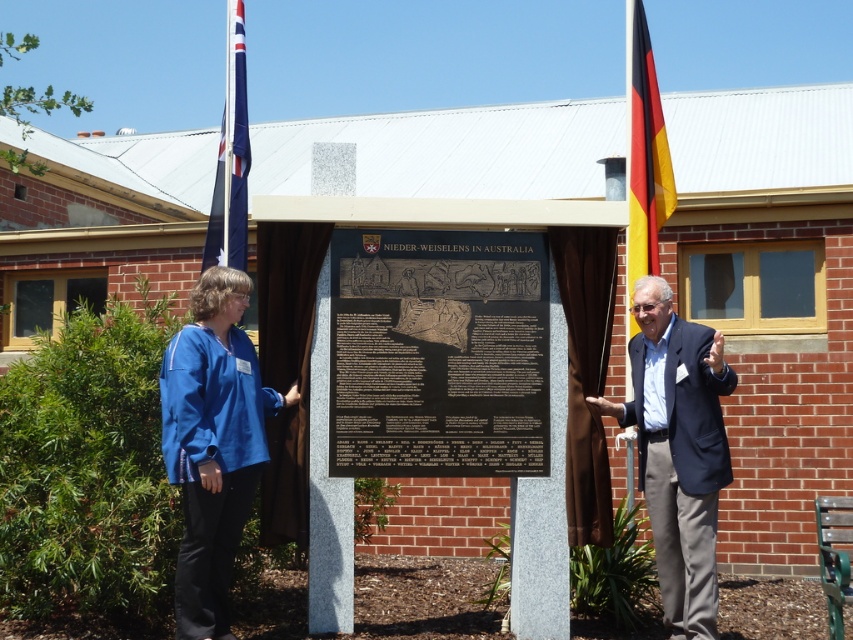
Question: Does dark blue suit at right lie in front of yellow and black striped flag at right?

Choices:
 (A) yes
 (B) no

Answer: (A)

Question: Which point is farther to the camera?

Choices:
 (A) (186, 573)
 (B) (231, 243)
 (C) (712, 451)
 (D) (639, 125)

Answer: (D)

Question: Is blue fabric shirt at left above blue fabric flag at upper left?

Choices:
 (A) yes
 (B) no

Answer: (B)

Question: Which object appears farthest from the camera in this image?

Choices:
 (A) yellow and black striped flag at right
 (B) blue fabric shirt at left

Answer: (A)

Question: Considering the real-world distances, which object is closest to the blue fabric shirt at left?

Choices:
 (A) dark blue suit at right
 (B) blue fabric flag at upper left
 (C) yellow and black striped flag at right

Answer: (B)

Question: Is blue fabric shirt at left wider than dark blue suit at right?

Choices:
 (A) no
 (B) yes

Answer: (A)